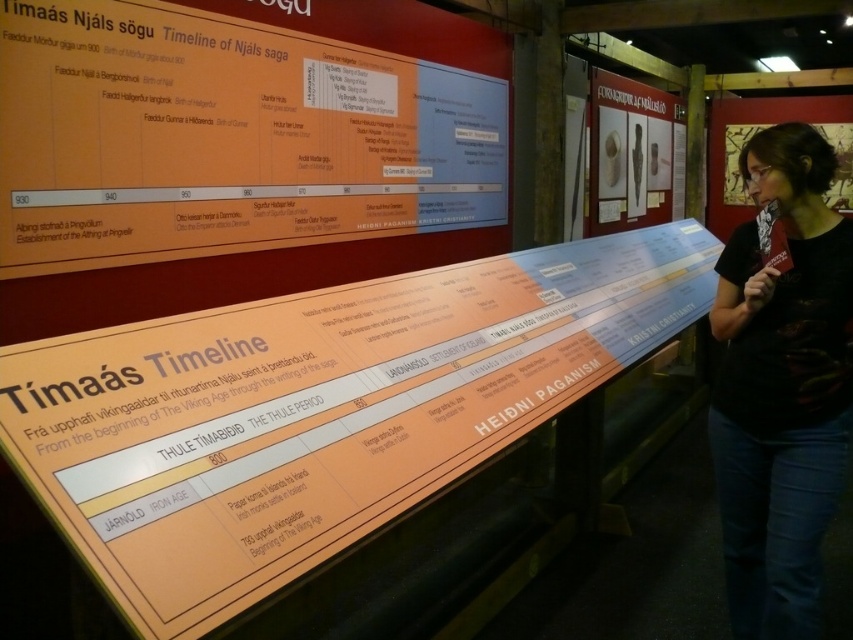
Based on the photo, you are a visitor at the museum and want to locate the point at coordinates point (607, 228) and point (840, 125) on the timeline display. Which point is closer to you when standing in front of the display?

Point (607, 228) is in front of point (840, 125), so the point (607, 228) is closer to you.

Based on the photo, you are a visitor at the museum and want to locate the matte plastic timeline at center. According to the coordinates provided, where exactly is it positioned?

The matte plastic timeline at center is located at point (318,410).

You are a visitor at the museum and want to take a photo of the timeline display. You notice two points on the timeline marked at coordinates point (416, 124) and point (787, 326). If you want to ensure both points are visible in your photo, which point should you focus on to capture both?

You should focus on point (787, 326) because point (416, 124) is behind it, so focusing on the forward point increases the likelihood of both being in the frame.